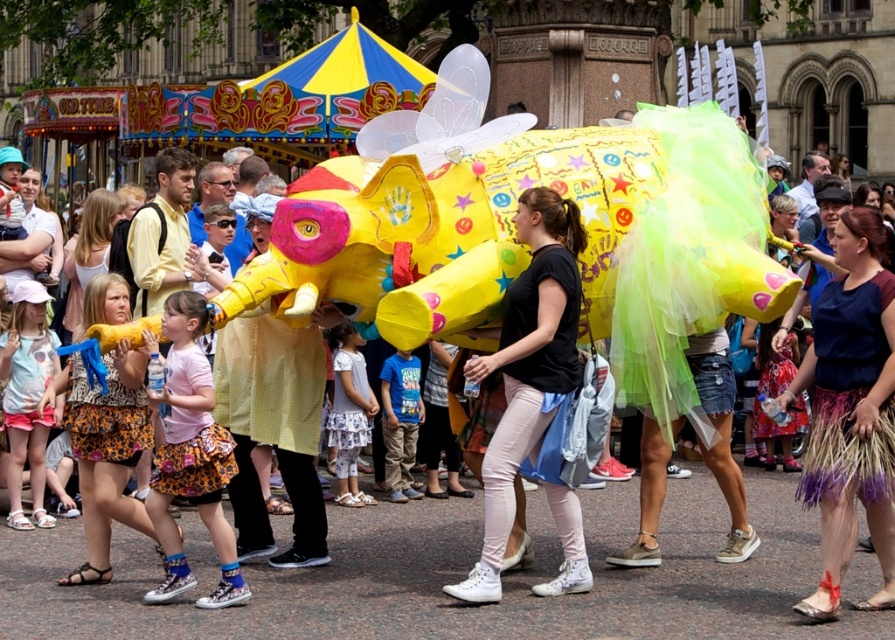
Question: Is black matte t-shirt at center below light pink cotton shirt at center?

Choices:
 (A) yes
 (B) no

Answer: (B)

Question: Which point appears closest to the camera in this image?

Choices:
 (A) (399, 364)
 (B) (864, 209)
 (C) (338, 465)
 (D) (151, 508)

Answer: (D)

Question: Is light pink cotton shirt at center to the left of blue cotton shirt at center from the viewer's perspective?

Choices:
 (A) yes
 (B) no

Answer: (A)

Question: Which object is farther from the camera taking this photo?

Choices:
 (A) straw skirt at center
 (B) light pink cotton shirt at center
 (C) white cotton dress at center

Answer: (C)

Question: Is straw skirt at center above pink fabric skirt at center?

Choices:
 (A) yes
 (B) no

Answer: (B)

Question: Estimate the real-world distances between objects in this image. Which object is closer to the white cotton dress at center?

Choices:
 (A) black matte t-shirt at center
 (B) pink fabric skirt at center
 (C) light pink cotton shirt at center

Answer: (A)